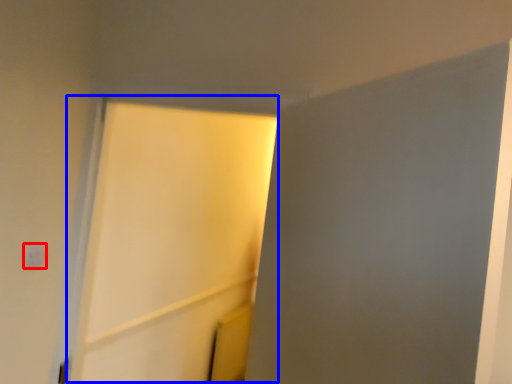
Question: Among these objects, which one is farthest to the camera, light switch (highlighted by a red box) or screen door (highlighted by a blue box)?

Choices:
 (A) light switch
 (B) screen door

Answer: (A)